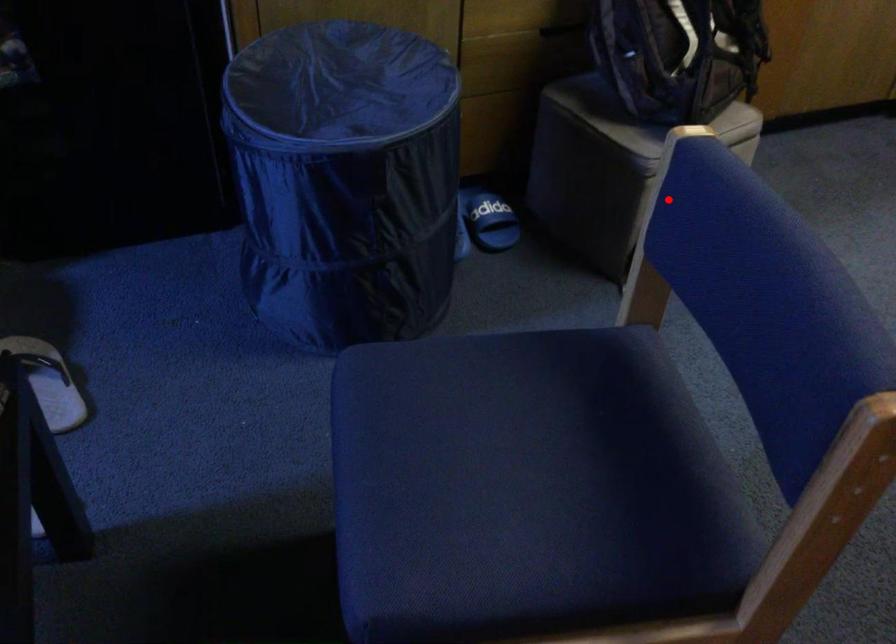
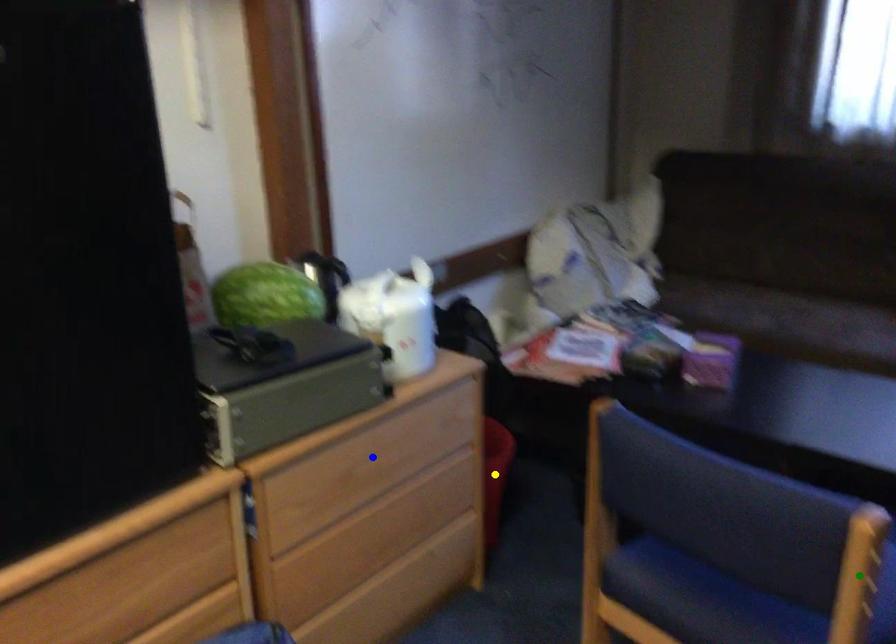
Question: I am providing you with two images of the same scene from different viewpoints. A red point is marked on the first image. You are given multiple points on the second image. Which point in image 2 is actually the same real-world point as the red point in image 1?

Choices:
 (A) green point
 (B) yellow point
 (C) blue point

Answer: (A)